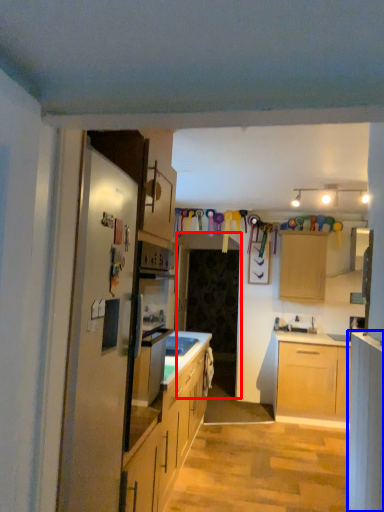
Question: Among these objects, which one is nearest to the camera, glass door (highlighted by a red box) or cabinetry (highlighted by a blue box)?

Choices:
 (A) glass door
 (B) cabinetry

Answer: (B)